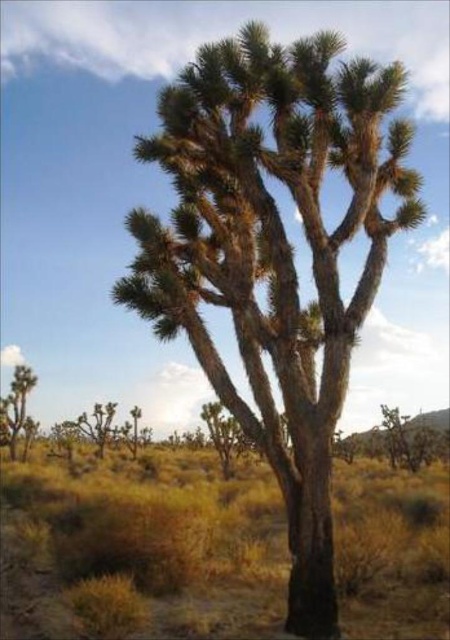
You are a botanist studying desert flora. You observe the point at coordinates (274, 253) in the image. Based on the scene description, can you identify what this point is pointing to?

The point at coordinates (274, 253) corresponds to the greenish brown bark tree at center.

You are a botanist studying desert flora and need to locate the brown textured tree at center for a close examination. Based on the coordinates provided, can you determine if the tree is positioned closer to the top or bottom of the image?

The brown textured tree at center is located at coordinates point (x=142, y=547). Since the y coordinate is 0.316, which is closer to 0.5 than 0, the tree is positioned closer to the bottom of the image.